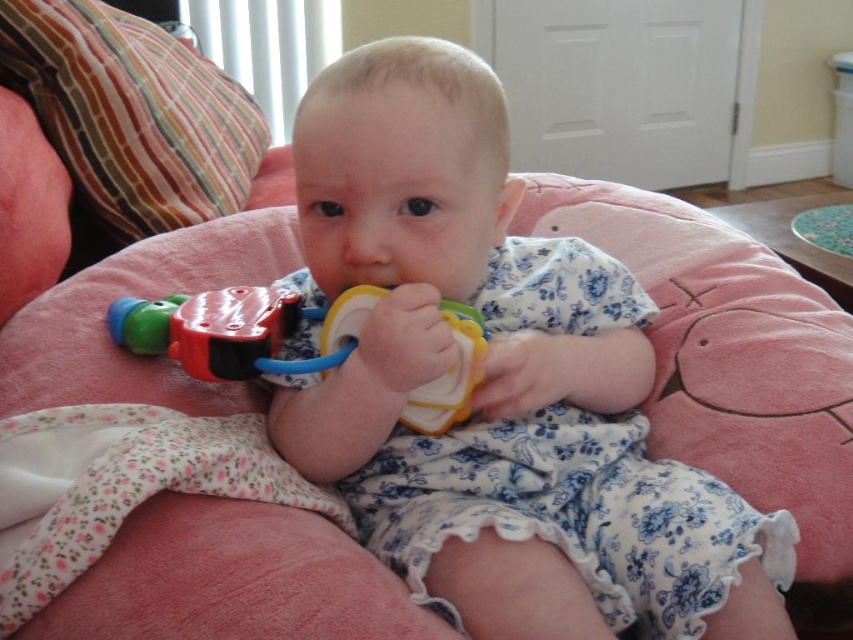
Which is behind, point (412, 307) or point (76, 102)?

Positioned behind is point (76, 102).

Can you confirm if matte plastic toy at center is thinner than striped fabric pillow at upper left?

Incorrect, matte plastic toy at center's width is not less than striped fabric pillow at upper left's.

Which is behind, point (463, 298) or point (80, 131)?

Positioned behind is point (80, 131).

In order to click on matte plastic toy at center in this screenshot , I will do `click(498, 384)`.

Does matte plastic toy at center have a greater height compared to rubberized plastic rattle at center?

Indeed, matte plastic toy at center has a greater height compared to rubberized plastic rattle at center.

Where is `matte plastic toy at center`? The image size is (853, 640). matte plastic toy at center is located at coordinates (498, 384).

Looking at this image, which is below, striped fabric pillow at upper left or rubberized plastic rattle at center?

rubberized plastic rattle at center is below.

Does point (227, 163) come behind point (323, 342)?

Yes, point (227, 163) is farther from viewer.

What do you see at coordinates (132, 113) in the screenshot?
I see `striped fabric pillow at upper left` at bounding box center [132, 113].

Locate an element on the screen. striped fabric pillow at upper left is located at coordinates (132, 113).